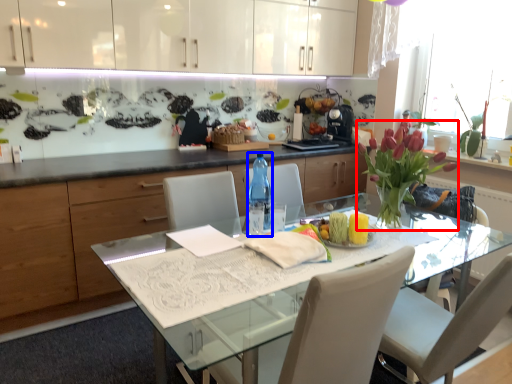
Question: Which point is closer to the camera, flower (highlighted by a red box) or bottle (highlighted by a blue box)?

Choices:
 (A) flower
 (B) bottle

Answer: (A)